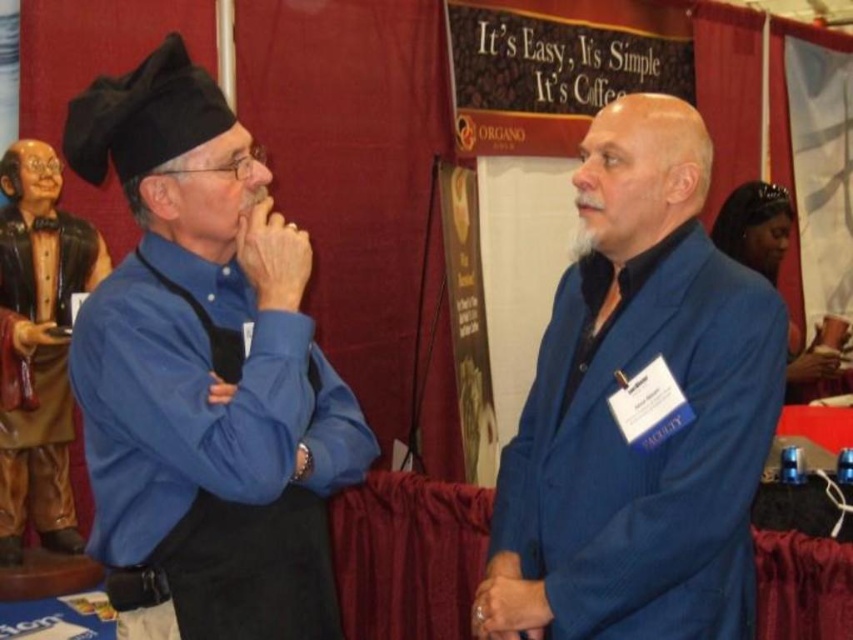
Question: Which object appears closest to the camera in this image?

Choices:
 (A) blue woolen suit at right
 (B) matte black hat at left

Answer: (B)

Question: Does matte black hat at left have a smaller size compared to brown leather robe at left?

Choices:
 (A) yes
 (B) no

Answer: (B)

Question: In this image, where is matte black hat at left located relative to brown leather robe at left?

Choices:
 (A) left
 (B) right

Answer: (B)

Question: Which of the following is the farthest from the observer?

Choices:
 (A) matte black hat at left
 (B) blue woolen suit at right
 (C) brown leather robe at left

Answer: (C)

Question: Does blue woolen suit at right appear on the right side of brown leather robe at left?

Choices:
 (A) yes
 (B) no

Answer: (A)

Question: Which point appears closest to the camera in this image?

Choices:
 (A) (173, 74)
 (B) (757, 440)
 (C) (51, 524)

Answer: (A)